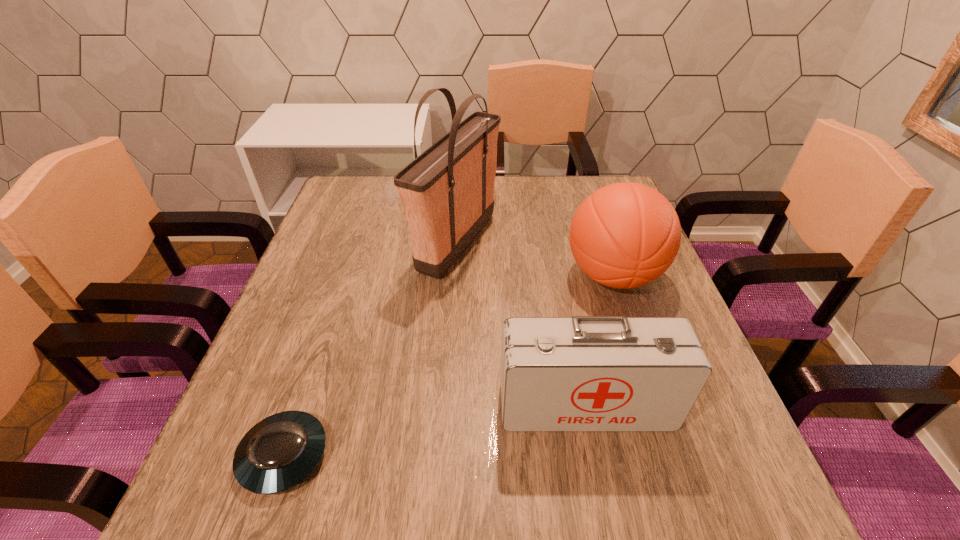
Where is `shopping bag`? The height and width of the screenshot is (540, 960). shopping bag is located at coordinates (447, 192).

Identify the location of the second tallest object. (625, 235).

You are a GUI agent. You are given a task and a screenshot of the screen. Output one action in this format:
    pyautogui.click(x=<x>, y=<y>)
    Task: Click on the second shortest object
    The width and height of the screenshot is (960, 540).
    Given the screenshot: What is the action you would take?
    point(582,373)

At what (x,y) coordinates should I click in order to perform the action: click on saucer. Please return your answer as a coordinate pair (x, y). The height and width of the screenshot is (540, 960). Looking at the image, I should click on (279, 452).

This screenshot has width=960, height=540. In order to click on the leftmost object in this screenshot , I will do `click(279, 452)`.

Locate an element on the screen. free location located 0.290m on the front of the shopping bag is located at coordinates (447, 401).

This screenshot has height=540, width=960. Find the location of `vacant space situated 0.170m on the front of the basketball`. vacant space situated 0.170m on the front of the basketball is located at coordinates (647, 375).

Locate an element on the screen. vacant space located 0.070m on the front-facing side of the first-aid kit is located at coordinates (599, 472).

Image resolution: width=960 pixels, height=540 pixels. Identify the location of vacant space situated 0.230m on the back of the shortest object. tap(330, 321).

Find the location of a particular element. This screenshot has width=960, height=540. object positioned at the far edge is located at coordinates (447, 192).